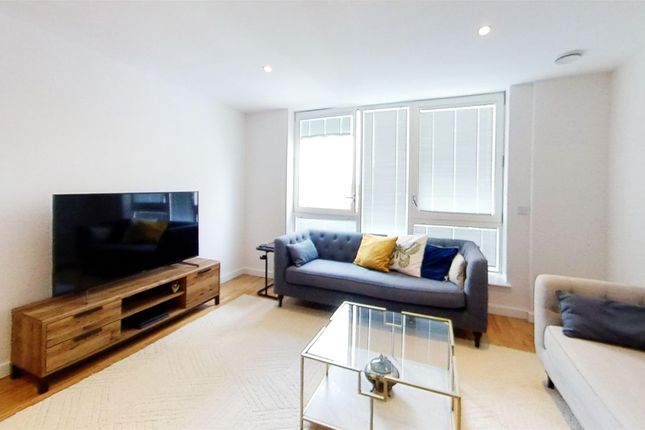
Locate an element on the screen. The image size is (645, 430). rug is located at coordinates (222, 381).